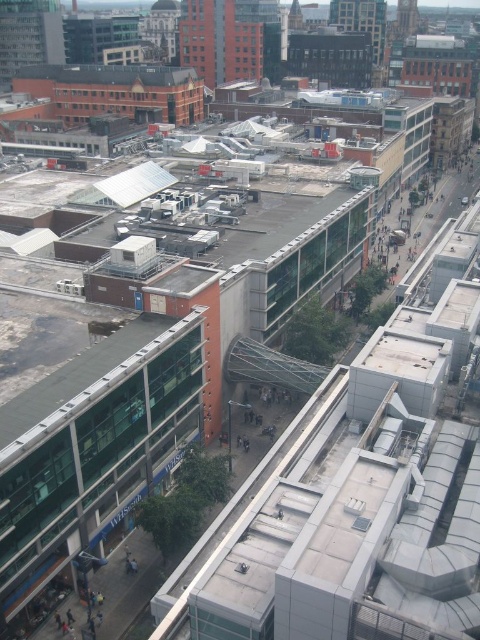
Question: From the image, what is the correct spatial relationship of green glass roof at center in relation to brown corrugated metal roof at upper center?

Choices:
 (A) right
 (B) left

Answer: (A)

Question: Among these points, which one is nearest to the camera?

Choices:
 (A) (152, 323)
 (B) (118, 83)

Answer: (A)

Question: Can you confirm if green glass roof at center is bigger than brown corrugated metal roof at upper center?

Choices:
 (A) no
 (B) yes

Answer: (A)

Question: Is green glass roof at center to the right of brown corrugated metal roof at upper center from the viewer's perspective?

Choices:
 (A) no
 (B) yes

Answer: (B)

Question: Which object appears closest to the camera in this image?

Choices:
 (A) brown corrugated metal roof at upper center
 (B) green glass roof at center

Answer: (B)